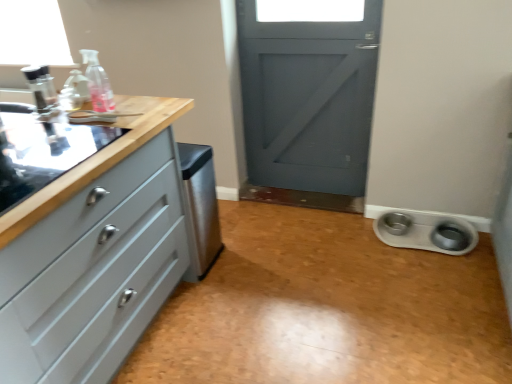
Question: Does white glossy pet bowls at lower right have a greater width compared to matte gray chest of drawers at left?

Choices:
 (A) no
 (B) yes

Answer: (B)

Question: Can you confirm if white glossy pet bowls at lower right is shorter than matte gray chest of drawers at left?

Choices:
 (A) yes
 (B) no

Answer: (A)

Question: Is white glossy pet bowls at lower right to the left of matte gray chest of drawers at left from the viewer's perspective?

Choices:
 (A) no
 (B) yes

Answer: (A)

Question: From the image's perspective, would you say white glossy pet bowls at lower right is shown under matte gray chest of drawers at left?

Choices:
 (A) yes
 (B) no

Answer: (A)

Question: Is the depth of white glossy pet bowls at lower right greater than that of matte gray chest of drawers at left?

Choices:
 (A) no
 (B) yes

Answer: (B)

Question: From a real-world perspective, relative to transparent plastic bottle at upper left, is white plastic pet bowls at lower right vertically above or below?

Choices:
 (A) above
 (B) below

Answer: (B)

Question: Considering the positions of point (412, 230) and point (102, 71), is point (412, 230) closer or farther from the camera than point (102, 71)?

Choices:
 (A) closer
 (B) farther

Answer: (B)

Question: In the image, is white plastic pet bowls at lower right on the left side or the right side of transparent plastic bottle at upper left?

Choices:
 (A) right
 (B) left

Answer: (A)

Question: Considering the positions of white plastic pet bowls at lower right and transparent plastic bottle at upper left in the image, is white plastic pet bowls at lower right bigger or smaller than transparent plastic bottle at upper left?

Choices:
 (A) small
 (B) big

Answer: (B)

Question: From a real-world perspective, is black glass sink at left physically located above or below transparent plastic bottle at upper left?

Choices:
 (A) below
 (B) above

Answer: (A)

Question: From the image's perspective, is black glass sink at left positioned above or below transparent plastic bottle at upper left?

Choices:
 (A) below
 (B) above

Answer: (A)

Question: Relative to transparent plastic bottle at upper left, is black glass sink at left in front or behind?

Choices:
 (A) front
 (B) behind

Answer: (A)

Question: Is black glass sink at left wider or thinner than transparent plastic bottle at upper left?

Choices:
 (A) wide
 (B) thin

Answer: (A)

Question: Relative to satin stainless steel dishwasher at center, is white glossy pet bowls at lower right in front or behind?

Choices:
 (A) front
 (B) behind

Answer: (A)

Question: Choose the correct answer: Is white glossy pet bowls at lower right inside satin stainless steel dishwasher at center or outside it?

Choices:
 (A) outside
 (B) inside

Answer: (A)